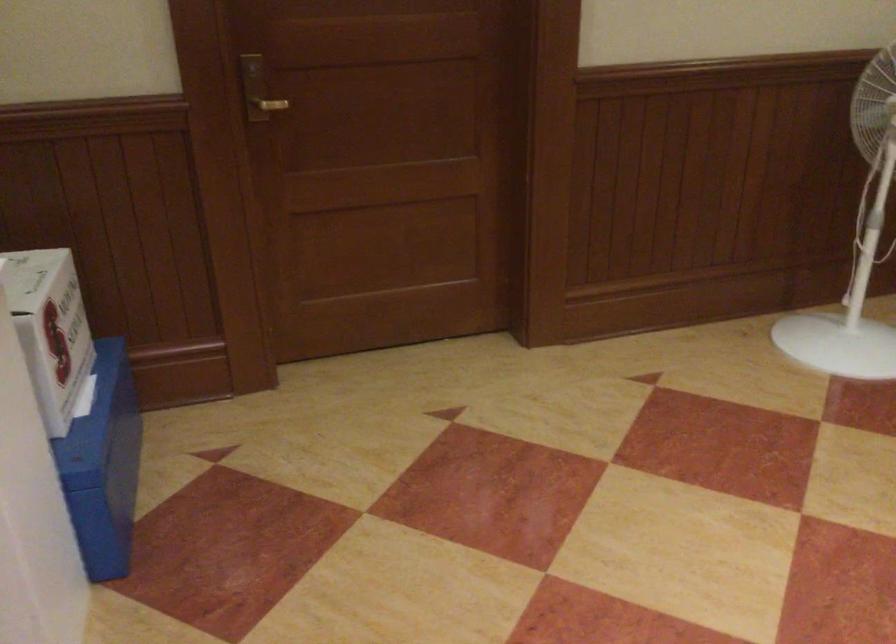
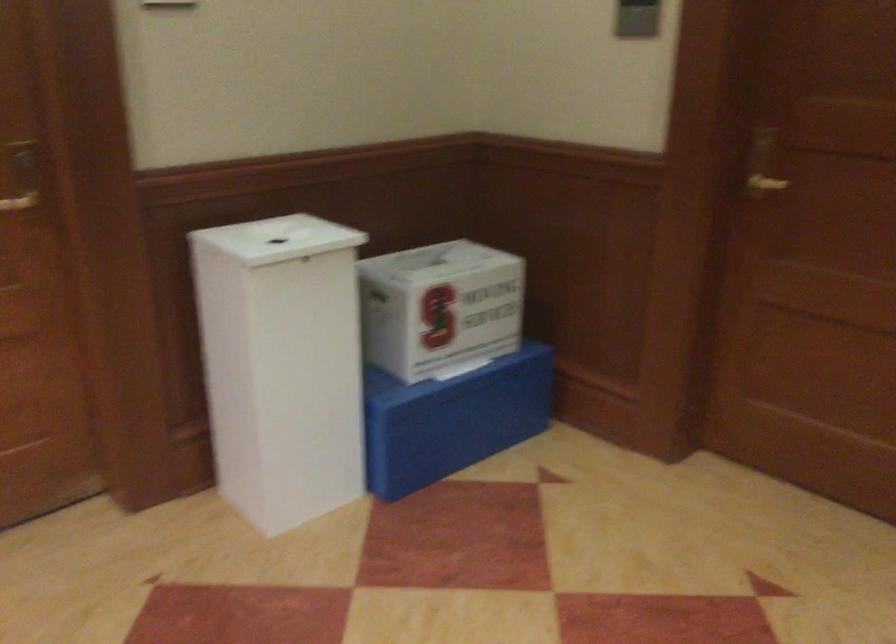
Locate, in the second image, the point that corresponds to (x=268, y=86) in the first image.

(762, 164)